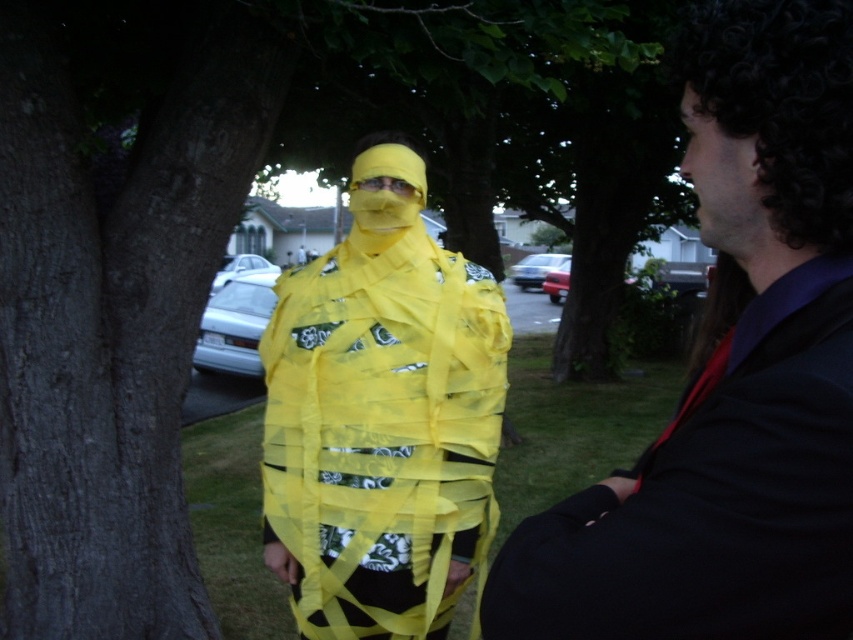
Is shiny black suit at right shorter than matte yellow tape at center?

Indeed, shiny black suit at right has a lesser height compared to matte yellow tape at center.

Which is in front, point (595, 538) or point (378, 561)?

Point (595, 538) is in front.

Find the location of a particular element. The width and height of the screenshot is (853, 640). shiny black suit at right is located at coordinates click(x=730, y=376).